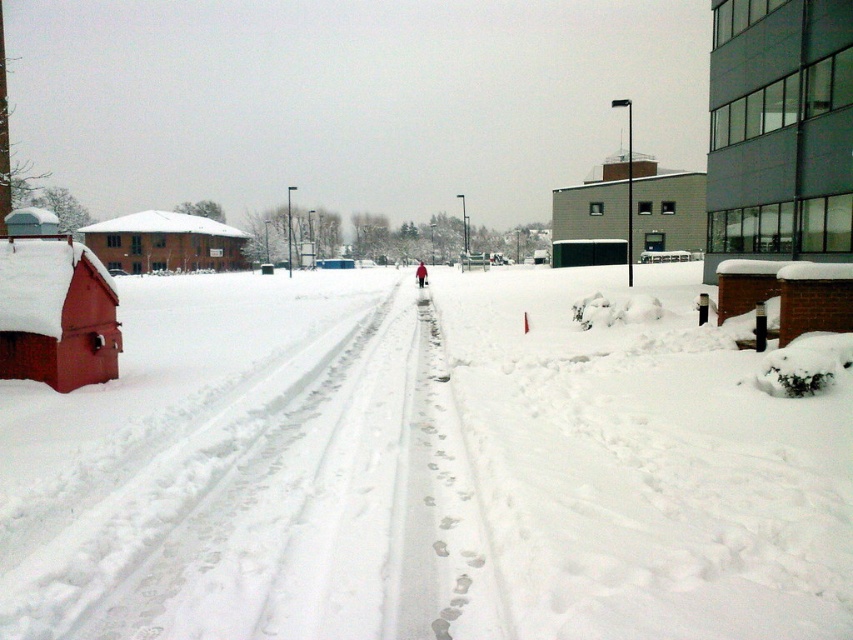
Question: Which point appears farthest from the camera in this image?

Choices:
 (A) (213, 252)
 (B) (244, 305)
 (C) (680, 230)

Answer: (A)

Question: Which point is closer to the camera taking this photo?

Choices:
 (A) pyautogui.click(x=184, y=392)
 (B) pyautogui.click(x=90, y=289)
 (C) pyautogui.click(x=695, y=221)
 (D) pyautogui.click(x=798, y=109)

Answer: (A)

Question: Can you confirm if white fluffy snow at lower left is positioned above smooth red wooden hut at left?

Choices:
 (A) no
 (B) yes

Answer: (A)

Question: In this image, where is dark gray glass building at right located relative to smooth red wooden hut at left?

Choices:
 (A) left
 (B) right

Answer: (B)

Question: Which of these objects is positioned closest to the smooth red wooden hut at left?

Choices:
 (A) dark gray glass building at right
 (B) white fluffy snow at lower left
 (C) gray concrete building at upper center

Answer: (B)

Question: Does smooth red wooden hut at left have a greater width compared to brown wooden hut at left?

Choices:
 (A) no
 (B) yes

Answer: (A)